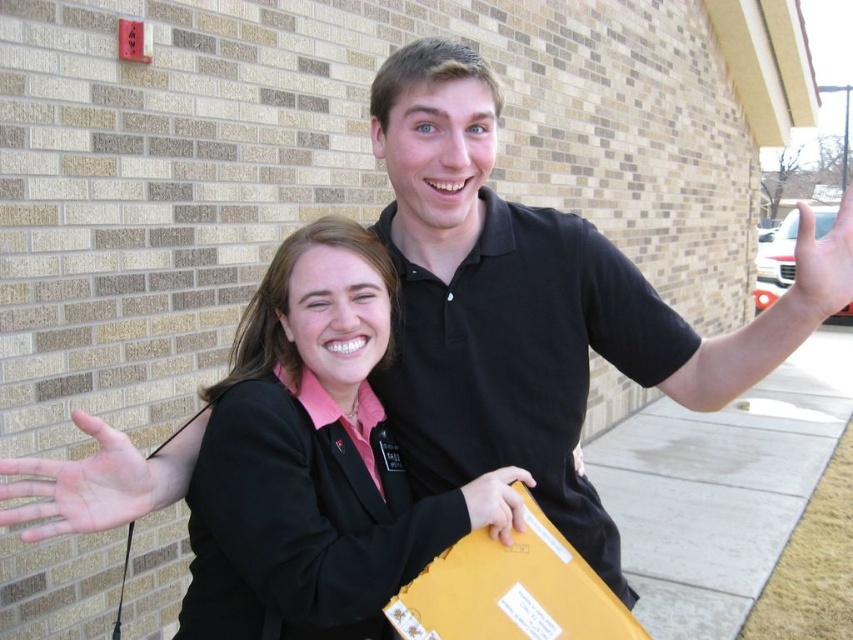
Question: Is black matte jacket at center thinner than pink matte hand at lower left?

Choices:
 (A) no
 (B) yes

Answer: (A)

Question: Which object is closer to the camera taking this photo?

Choices:
 (A) matte yellow envelope at right
 (B) yellow cardboard box at lower center

Answer: (A)

Question: Which of the following is the farthest from the observer?

Choices:
 (A) yellow cardboard box at lower center
 (B) black matte jacket at center
 (C) matte yellow folder at center

Answer: (C)

Question: Which of these objects is positioned farthest from the matte yellow envelope at right?

Choices:
 (A) pink matte hand at lower left
 (B) black matte jacket at center

Answer: (A)

Question: Does pink matte hand at lower left have a lesser width compared to matte yellow folder at center?

Choices:
 (A) yes
 (B) no

Answer: (B)

Question: Where is black matte jacket at center located in relation to matte yellow envelope at right in the image?

Choices:
 (A) right
 (B) left

Answer: (B)